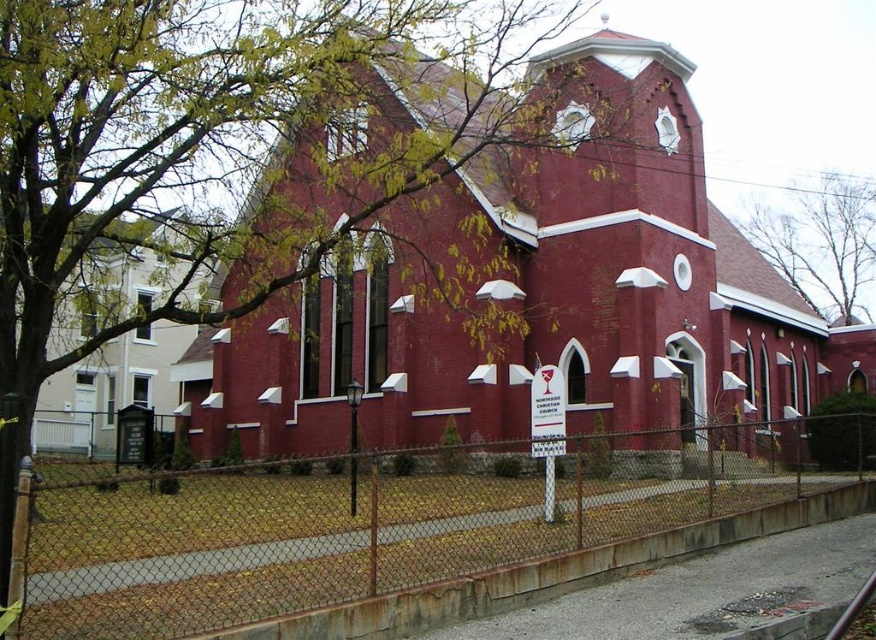
You are a visitor approaching the red brick church and notice the matte brick church at center and the brown leafy tree at upper center in your view. Which object appears taller in the scene?

The matte brick church at center appears much taller than the brown leafy tree at upper center according to the description.